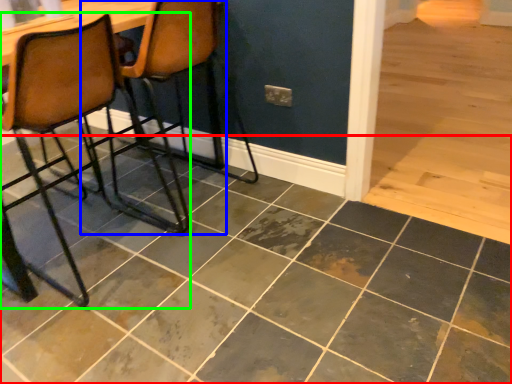
Question: Which is farther away from ceramic tile (highlighted by a red box)? chair (highlighted by a blue box) or chair (highlighted by a green box)?

Choices:
 (A) chair
 (B) chair

Answer: (A)